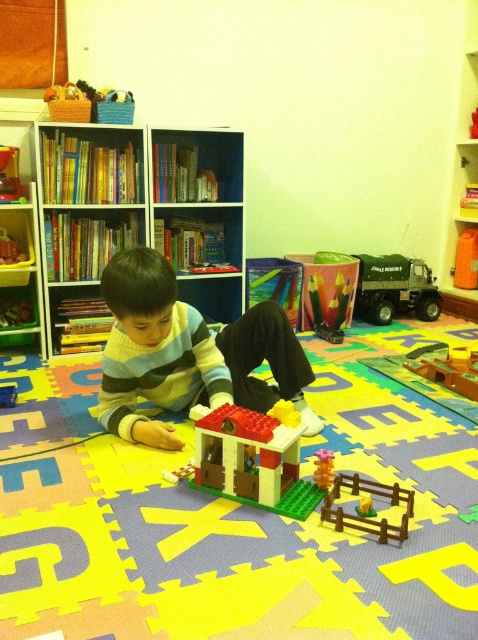
Question: Which is nearer to the striped sweater at center?

Choices:
 (A) brown wooden fence at lower center
 (B) smooth plastic fence at lower center
 (C) wooden boat at center

Answer: (B)

Question: In this image, where is brown wooden fence at lower center located relative to smooth plastic fence at lower center?

Choices:
 (A) left
 (B) right

Answer: (B)

Question: Estimate the real-world distances between objects in this image. Which object is farther from the yellow plastic toy at center?

Choices:
 (A) smooth plastic fence at lower center
 (B) striped sweater at center

Answer: (A)

Question: Which object appears closest to the camera in this image?

Choices:
 (A) matte plastic toy at center
 (B) smooth plastic fence at lower center
 (C) brick-like plastic house at center
 (D) wooden bookshelf at upper left

Answer: (C)

Question: Is wooden boat at center bigger than smooth plastic fence at lower center?

Choices:
 (A) yes
 (B) no

Answer: (A)

Question: Is the position of wooden bookshelf at upper left less distant than that of smooth plastic toy at center?

Choices:
 (A) no
 (B) yes

Answer: (B)